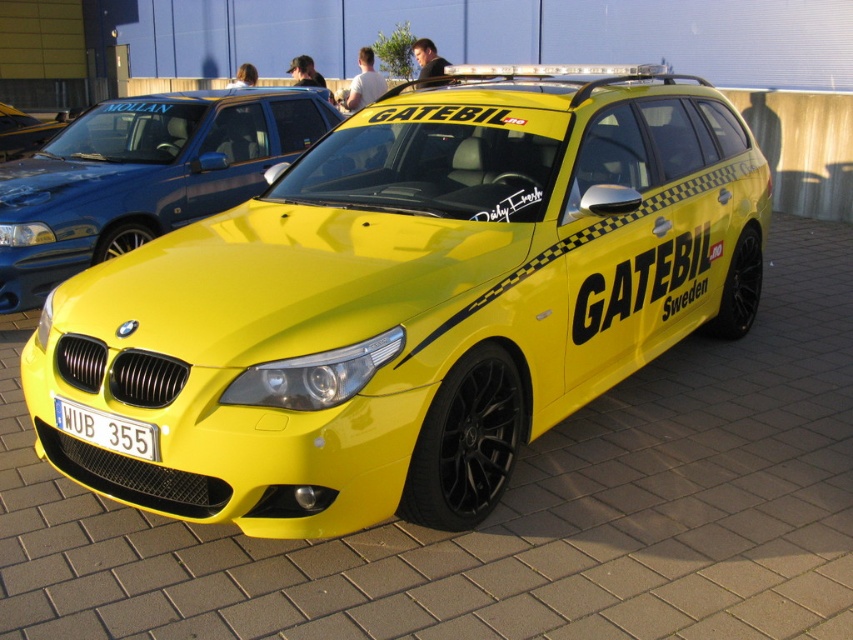
Is point (61, 408) in front of point (15, 148)?

That is True.

Does white carbon fiber license plate at front appear under yellow matte car at center?

Yes.

Locate an element on the screen. white carbon fiber license plate at front is located at coordinates (107, 429).

Locate an element on the screen. Image resolution: width=853 pixels, height=640 pixels. white carbon fiber license plate at front is located at coordinates (107, 429).

Based on the photo, who is more distant from viewer, (648, 154) or (15, 138)?

Positioned behind is point (15, 138).

Who is higher up, glossy yellow car at center or yellow matte car at center?

yellow matte car at center is higher up.

Is point (285, 508) positioned before point (13, 156)?

Yes, point (285, 508) is in front of point (13, 156).

Find the location of a particular element. glossy yellow car at center is located at coordinates (410, 300).

Who is positioned more to the right, glossy yellow car at center or white carbon fiber license plate at front?

Positioned to the right is glossy yellow car at center.

Between glossy yellow car at center and white carbon fiber license plate at front, which one has more height?

With more height is glossy yellow car at center.

Who is more distant from viewer, [635,218] or [93,420]?

Point [635,218]

Locate an element on the screen. Image resolution: width=853 pixels, height=640 pixels. glossy yellow car at center is located at coordinates (410, 300).